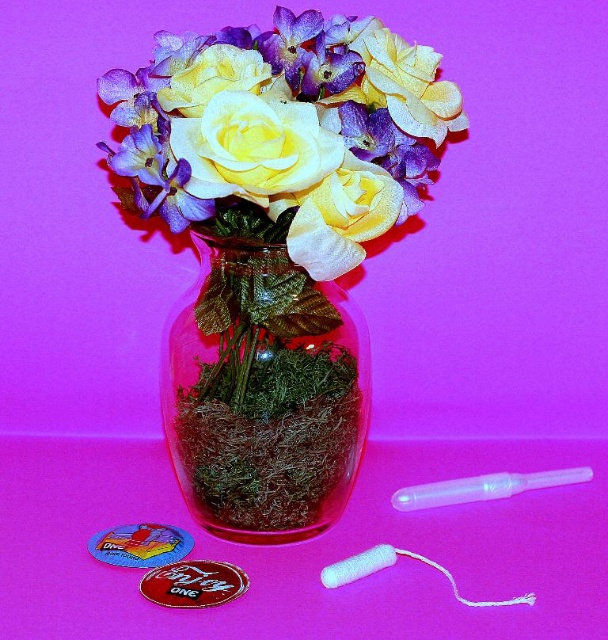
Can you confirm if translucent glass vase at center is bigger than matte yellow fabric rose at center?

Yes, translucent glass vase at center is bigger than matte yellow fabric rose at center.

Describe the element at coordinates (274, 244) in the screenshot. I see `translucent glass vase at center` at that location.

This screenshot has width=608, height=640. I want to click on translucent glass vase at center, so click(x=274, y=244).

Is transparent glass vase at center positioned before matte yellow rose at center?

No, it is not.

Locate an element on the screen. transparent glass vase at center is located at coordinates (263, 396).

Does transparent glass vase at center have a greater width compared to matte yellow fabric rose at center?

Indeed, transparent glass vase at center has a greater width compared to matte yellow fabric rose at center.

Describe the element at coordinates (263, 396) in the screenshot. I see `transparent glass vase at center` at that location.

In order to click on transparent glass vase at center in this screenshot , I will do `click(263, 396)`.